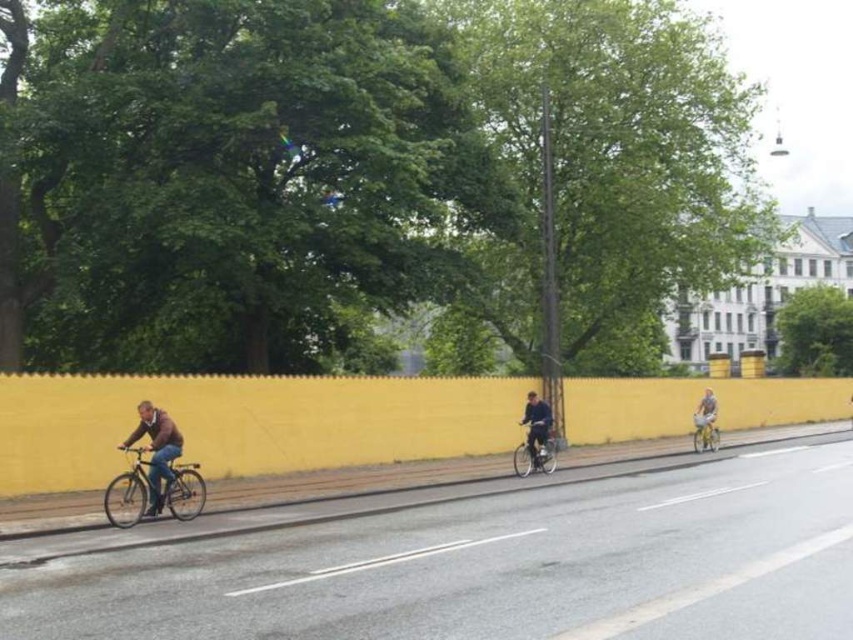
You are a delivery person who needs to pass through a narrow alley that is only 1.5 meters wide. You see a shiny metallic bicycle at left and a dark blue jacket at center in the scene. Can your 1.5 meter wide delivery cart fit between them?

The shiny metallic bicycle at left might be wider than dark blue jacket at center. However, since the exact width of the bicycle isn t specified, it s possible that the space between them could be narrower than 1.5 meters. To ensure safety, you should measure the space before proceeding.

You are a painter standing on the street and want to paint the yellow matte wall at center and the brown leather jacket at left. Which object will require more vertical space on your canvas?

The yellow matte wall at center has a greater height compared to the brown leather jacket at left, so it will require more vertical space on the canvas.

You are a drone operator flying a drone that is 1.5 meters in length. You need to capture a closeup shot of the yellow matte wall at center. Considering the drone must stay at least 2 meters away from any object for safety, is the current distance sufficient?

The yellow matte wall at center is 18.44 meters from camera. Since the drone must stay at least 2 meters away, the current distance of 18.44 meters is more than enough to safely capture the closeup shot.